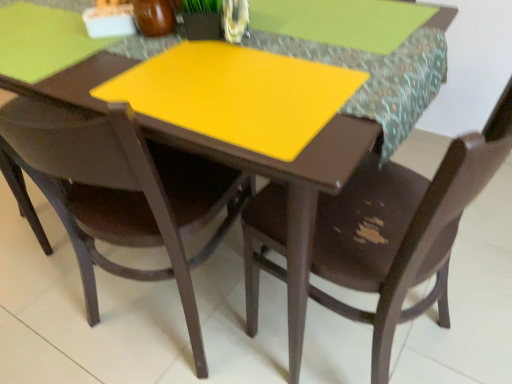
Question: From the image's perspective, relative to brown matte chair at center, acting as the 2th chair starting from the left, is matte brown chair at center, the second chair viewed from the right, above or below?

Choices:
 (A) below
 (B) above

Answer: (B)

Question: Would you say matte brown chair at center, arranged as the first chair when viewed from the left, is to the left or to the right of brown matte chair at center, acting as the 2th chair starting from the left, in the picture?

Choices:
 (A) right
 (B) left

Answer: (B)

Question: Which object is positioned farthest from the brown matte chair at center, which is counted as the first chair, starting from the right?

Choices:
 (A) yellow matte placemat at center
 (B) matte brown chair at center, the second chair viewed from the right

Answer: (B)

Question: Considering the real-world distances, which object is closest to the yellow matte placemat at center?

Choices:
 (A) brown matte chair at center, which is counted as the first chair, starting from the right
 (B) matte brown chair at center, the second chair viewed from the right

Answer: (A)